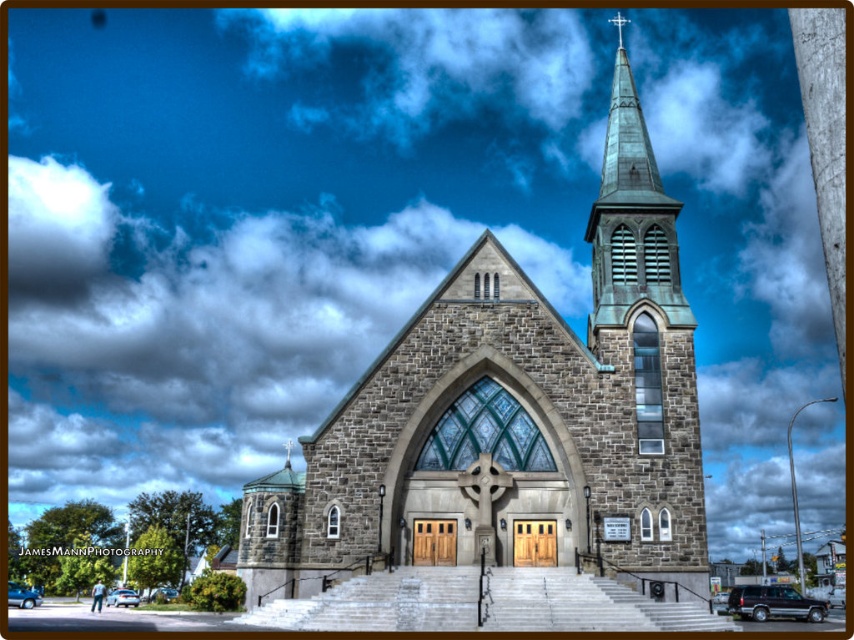
You are standing in a field looking at the gray stone church at center. If you walk straight towards it for 50 meters, will you reach the church?

The gray stone church at center is 55.85 meters away from your current position. After walking 50 meters, you will still be 5.85 meters away from the church and will not have reached it yet.

You are standing at the base of the church and want to take a photo of the green copper steeple at upper right. If your camera has a maximum zoom range of 100 feet, will you be able to capture the steeple clearly without moving closer?

The green copper steeple at upper right is 183.20 feet away from the viewer. Since the camera can only zoom up to 100 feet, you won cannot capture it clearly without moving closer.